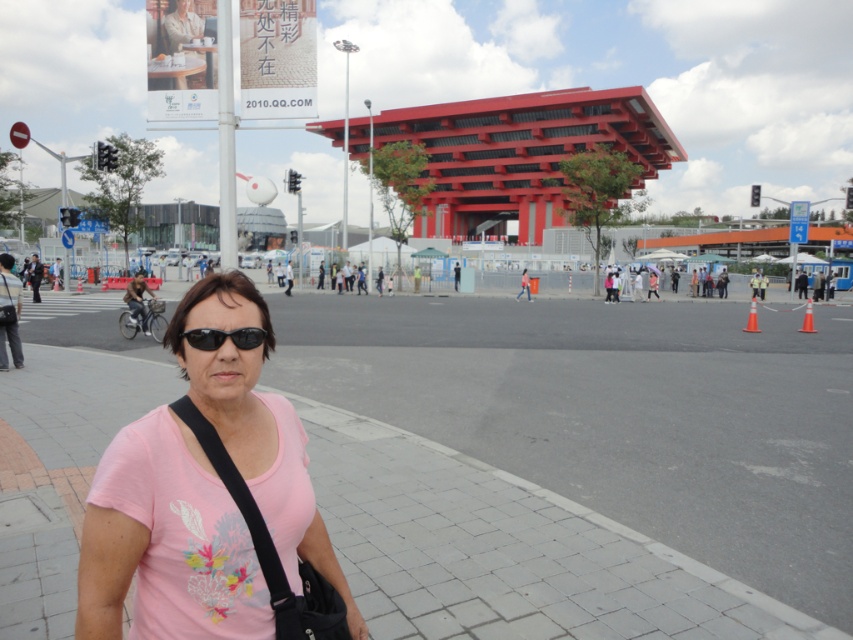
Question: Does pink fabric shirt at center come in front of black matte sunglasses at center?

Choices:
 (A) no
 (B) yes

Answer: (B)

Question: Considering the real-world distances, which object is closest to the gray concrete pavement at lower left?

Choices:
 (A) pink fabric shirt at center
 (B) black matte sunglasses at center

Answer: (A)

Question: Considering the relative positions of gray concrete pavement at lower left and black matte sunglasses at center in the image provided, where is gray concrete pavement at lower left located with respect to black matte sunglasses at center?

Choices:
 (A) left
 (B) right

Answer: (B)

Question: Which object appears farthest from the camera in this image?

Choices:
 (A) gray concrete pavement at lower left
 (B) black matte sunglasses at center

Answer: (A)

Question: Is gray concrete pavement at lower left wider than pink fabric shirt at center?

Choices:
 (A) yes
 (B) no

Answer: (A)

Question: Which of the following is the farthest from the observer?

Choices:
 (A) black matte sunglasses at center
 (B) gray concrete pavement at lower left

Answer: (B)